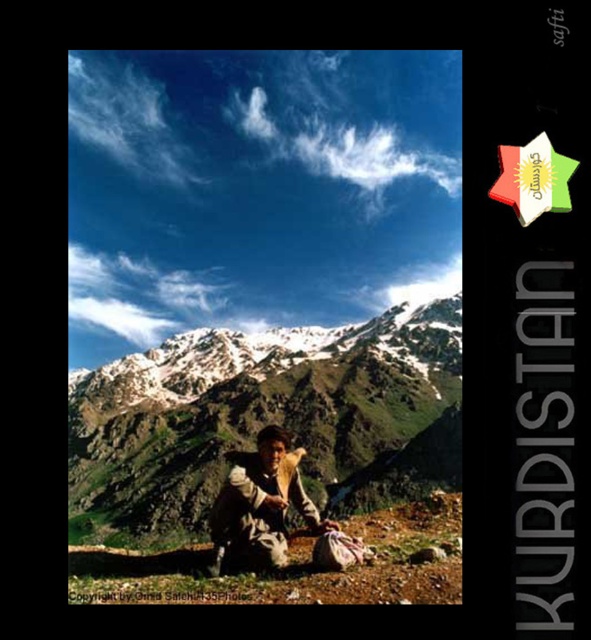
Measure the distance between snowy rock mountain at center and camera.

snowy rock mountain at center is 317.54 feet from camera.

Locate an element on the screen. This screenshot has width=591, height=640. snowy rock mountain at center is located at coordinates 267,419.